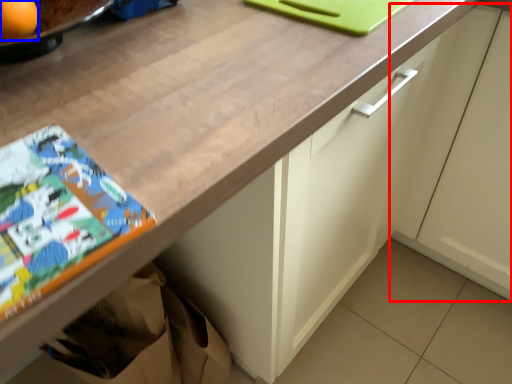
Question: Which object appears farthest to the camera in this image, cabinetry (highlighted by a red box) or orange (highlighted by a blue box)?

Choices:
 (A) cabinetry
 (B) orange

Answer: (A)